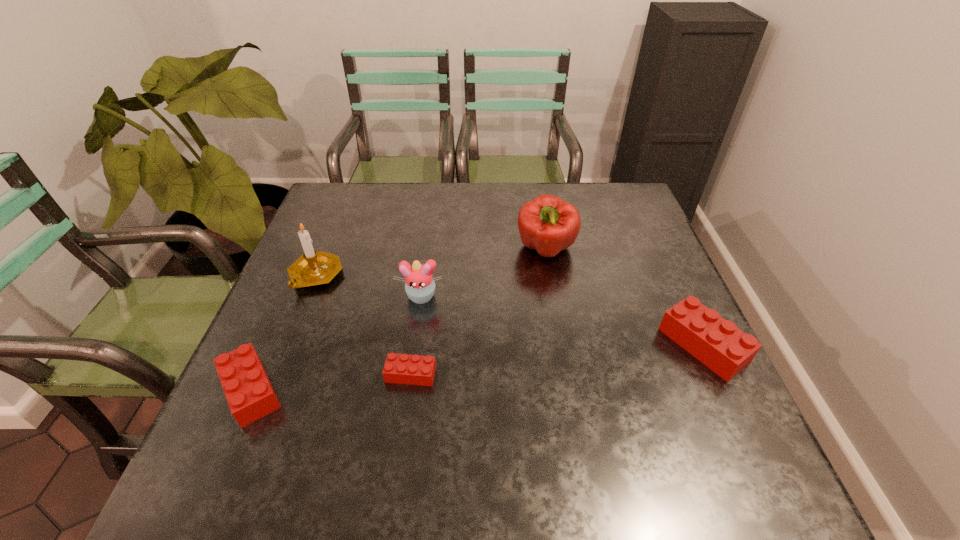
Locate an element on the screen. This screenshot has width=960, height=540. free space at the left edge is located at coordinates (283, 308).

The width and height of the screenshot is (960, 540). I want to click on vacant area at the right edge, so [x=616, y=281].

Find the location of a particular element. The height and width of the screenshot is (540, 960). vacant space at the far left corner of the desktop is located at coordinates [336, 211].

Locate an element on the screen. The width and height of the screenshot is (960, 540). vacant space at the far right corner of the desktop is located at coordinates (596, 214).

Identify the location of free area in between the candle holder and the third tallest object. (369, 286).

The width and height of the screenshot is (960, 540). Identify the location of blank region between the bell pepper and the rightmost Lego. (624, 297).

Where is `blank region between the rightmost object and the second tallest Lego`? Image resolution: width=960 pixels, height=540 pixels. blank region between the rightmost object and the second tallest Lego is located at coordinates (477, 368).

Locate an element on the screen. vacant space in between the fourth shortest object and the fifth object from left to right is located at coordinates (484, 273).

Image resolution: width=960 pixels, height=540 pixels. Find the location of `free space between the second tallest Lego and the bell pepper`. free space between the second tallest Lego and the bell pepper is located at coordinates (398, 320).

Locate an element on the screen. The width and height of the screenshot is (960, 540). free space between the rightmost object and the shortest Lego is located at coordinates click(557, 360).